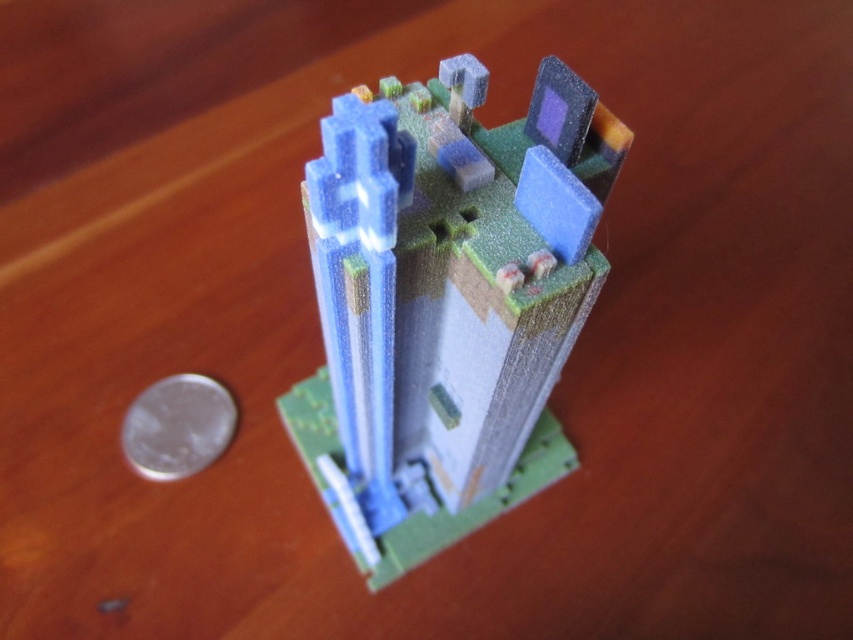
You are a tiny explorer who just landed on the wooden surface. You see the translucent plastic building at center and the silver metallic coin at lower left. Which object is wider?

The translucent plastic building at center is wider than the silver metallic coin at lower left.

You are a small robot with a height of 2 centimeters. You need to pick up the silver metallic coin at lower left without touching the translucent plastic building at center. Is this possible?

The translucent plastic building at center is positioned over the silver metallic coin at lower left, so the robot cannot reach the coin without touching the building.